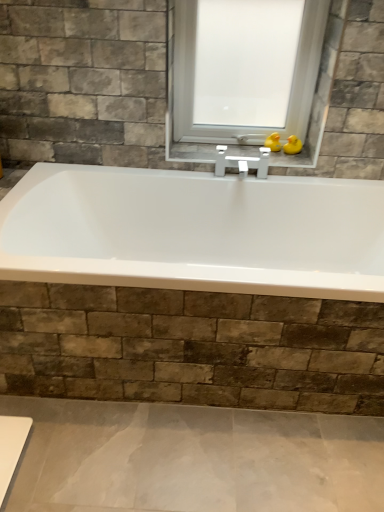
The image size is (384, 512). What do you see at coordinates (247, 75) in the screenshot? I see `transparent glass window at center` at bounding box center [247, 75].

At what (x,y) coordinates should I click in order to perform the action: click on yellow rubber duck at upper right, the 1th duck when ordered from right to left. Please return your answer as a coordinate pair (x, y). This screenshot has width=384, height=512. Looking at the image, I should click on (292, 145).

Image resolution: width=384 pixels, height=512 pixels. What do you see at coordinates (273, 142) in the screenshot? I see `yellow rubber duck at upper center, marked as the 2th duck in a right-to-left arrangement` at bounding box center [273, 142].

Where is `transparent glass window at center`? This screenshot has width=384, height=512. transparent glass window at center is located at coordinates (247, 75).

Based on the photo, is yellow rubber duck at upper right, the 2th duck in the left-to-right sequence, inside the boundaries of yellow rubber duck at upper center, the 1th duck viewed from the left, or outside?

The correct answer is: outside.

Which of these two, yellow rubber duck at upper right, the 2th duck in the left-to-right sequence, or yellow rubber duck at upper center, marked as the 2th duck in a right-to-left arrangement, stands shorter?

yellow rubber duck at upper right, the 2th duck in the left-to-right sequence, is shorter.

Relative to yellow rubber duck at upper center, the 1th duck viewed from the left, is yellow rubber duck at upper right, the 2th duck in the left-to-right sequence, in front or behind?

yellow rubber duck at upper right, the 2th duck in the left-to-right sequence, is positioned closer to the viewer than yellow rubber duck at upper center, the 1th duck viewed from the left.

You are a GUI agent. You are given a task and a screenshot of the screen. Output one action in this format:
    pyautogui.click(x=<x>, y=<y>)
    Task: Click on the duck located underneath the yellow rubber duck at upper right, the 2th duck in the left-to-right sequence (from a real-world perspective)
    
    Given the screenshot: What is the action you would take?
    pyautogui.click(x=273, y=142)

Considering the relative positions of transparent glass window at center and yellow rubber duck at upper right, the 2th duck in the left-to-right sequence, in the image provided, is transparent glass window at center in front of yellow rubber duck at upper right, the 2th duck in the left-to-right sequence,?

Yes, the depth of transparent glass window at center is less than that of yellow rubber duck at upper right, the 2th duck in the left-to-right sequence.

Looking at this image, considering the sizes of transparent glass window at center and yellow rubber duck at upper right, the 1th duck when ordered from right to left, in the image, is transparent glass window at center taller or shorter than yellow rubber duck at upper right, the 1th duck when ordered from right to left,?

In the image, transparent glass window at center appears to be taller than yellow rubber duck at upper right, the 1th duck when ordered from right to left.

Could you measure the distance between transparent glass window at center and yellow rubber duck at upper right, the 1th duck when ordered from right to left?

The distance of transparent glass window at center from yellow rubber duck at upper right, the 1th duck when ordered from right to left, is 38.32 centimeters.

Can you see transparent glass window at center touching yellow rubber duck at upper right, the 2th duck in the left-to-right sequence?

No.

Choose the correct answer: Is yellow rubber duck at upper right, the 1th duck when ordered from right to left, inside transparent glass window at center or outside it?

yellow rubber duck at upper right, the 1th duck when ordered from right to left, is outside transparent glass window at center.

From a real-world perspective, is yellow rubber duck at upper right, the 1th duck when ordered from right to left, positioned above or below transparent glass window at center?

Clearly, from a real-world perspective, yellow rubber duck at upper right, the 1th duck when ordered from right to left, is below transparent glass window at center.

Based on their sizes in the image, would you say yellow rubber duck at upper right, the 1th duck when ordered from right to left, is bigger or smaller than transparent glass window at center?

In the image, yellow rubber duck at upper right, the 1th duck when ordered from right to left, appears to be smaller than transparent glass window at center.

Considering the relative sizes of transparent glass window at center and yellow rubber duck at upper center, marked as the 2th duck in a right-to-left arrangement, in the image provided, is transparent glass window at center shorter than yellow rubber duck at upper center, marked as the 2th duck in a right-to-left arrangement,?

In fact, transparent glass window at center may be taller than yellow rubber duck at upper center, marked as the 2th duck in a right-to-left arrangement.

From a real-world perspective, which object rests below the other?

yellow rubber duck at upper center, the 1th duck viewed from the left.

Is transparent glass window at center oriented away from yellow rubber duck at upper center, marked as the 2th duck in a right-to-left arrangement?

No, transparent glass window at center's orientation is not away from yellow rubber duck at upper center, marked as the 2th duck in a right-to-left arrangement.

Is yellow rubber duck at upper center, the 1th duck viewed from the left, further to the viewer compared to transparent glass window at center?

That is True.

Is yellow rubber duck at upper center, the 1th duck viewed from the left, in contact with transparent glass window at center?

No, yellow rubber duck at upper center, the 1th duck viewed from the left, is not in contact with transparent glass window at center.

Which of these two, yellow rubber duck at upper center, marked as the 2th duck in a right-to-left arrangement, or transparent glass window at center, is thinner?

With smaller width is yellow rubber duck at upper center, marked as the 2th duck in a right-to-left arrangement.

Between yellow rubber duck at upper center, marked as the 2th duck in a right-to-left arrangement, and transparent glass window at center, which one has smaller size?

yellow rubber duck at upper center, marked as the 2th duck in a right-to-left arrangement.

From a real-world perspective, between yellow rubber duck at upper center, the 1th duck viewed from the left, and yellow rubber duck at upper right, the 2th duck in the left-to-right sequence, who is vertically lower?

In real-world perspective, yellow rubber duck at upper center, the 1th duck viewed from the left, is lower.

In the scene shown: Could you measure the distance between yellow rubber duck at upper center, the 1th duck viewed from the left, and yellow rubber duck at upper right, the 2th duck in the left-to-right sequence?

The distance of yellow rubber duck at upper center, the 1th duck viewed from the left, from yellow rubber duck at upper right, the 2th duck in the left-to-right sequence, is 2.38 inches.

How many degrees apart are the facing directions of yellow rubber duck at upper center, marked as the 2th duck in a right-to-left arrangement, and yellow rubber duck at upper right, the 2th duck in the left-to-right sequence?

The angle between the facing direction of yellow rubber duck at upper center, marked as the 2th duck in a right-to-left arrangement, and the facing direction of yellow rubber duck at upper right, the 2th duck in the left-to-right sequence, is 0.00449 degrees.

In the image, is yellow rubber duck at upper center, marked as the 2th duck in a right-to-left arrangement, positioned in front of or behind yellow rubber duck at upper right, the 2th duck in the left-to-right sequence?

yellow rubber duck at upper center, marked as the 2th duck in a right-to-left arrangement, is behind yellow rubber duck at upper right, the 2th duck in the left-to-right sequence.

Where is `duck behind the yellow rubber duck at upper right, the 2th duck in the left-to-right sequence`? duck behind the yellow rubber duck at upper right, the 2th duck in the left-to-right sequence is located at coordinates (273, 142).

Image resolution: width=384 pixels, height=512 pixels. I want to click on window lying above the yellow rubber duck at upper right, the 2th duck in the left-to-right sequence (from the image's perspective), so click(247, 75).

Considering their positions, is yellow rubber duck at upper center, marked as the 2th duck in a right-to-left arrangement, positioned further to transparent glass window at center than yellow rubber duck at upper right, the 2th duck in the left-to-right sequence?

yellow rubber duck at upper right, the 2th duck in the left-to-right sequence, lies further to transparent glass window at center than the other object.

When comparing their distances from yellow rubber duck at upper right, the 2th duck in the left-to-right sequence, does yellow rubber duck at upper center, the 1th duck viewed from the left, or transparent glass window at center seem further?

Based on the image, transparent glass window at center appears to be further to yellow rubber duck at upper right, the 2th duck in the left-to-right sequence.

From the image, which object appears to be farther from yellow rubber duck at upper right, the 1th duck when ordered from right to left, transparent glass window at center or yellow rubber duck at upper center, the 1th duck viewed from the left?

The object further to yellow rubber duck at upper right, the 1th duck when ordered from right to left, is transparent glass window at center.

Looking at the image, which one is located closer to transparent glass window at center, yellow rubber duck at upper right, the 1th duck when ordered from right to left, or yellow rubber duck at upper center, marked as the 2th duck in a right-to-left arrangement?

yellow rubber duck at upper center, marked as the 2th duck in a right-to-left arrangement.

Which object lies further to the anchor point yellow rubber duck at upper center, the 1th duck viewed from the left, transparent glass window at center or yellow rubber duck at upper right, the 2th duck in the left-to-right sequence?

Among the two, transparent glass window at center is located further to yellow rubber duck at upper center, the 1th duck viewed from the left.

Based on their spatial positions, is yellow rubber duck at upper right, the 2th duck in the left-to-right sequence, or transparent glass window at center further from yellow rubber duck at upper center, the 1th duck viewed from the left?

transparent glass window at center lies further to yellow rubber duck at upper center, the 1th duck viewed from the left, than the other object.

Identify the location of duck that lies between transparent glass window at center and yellow rubber duck at upper right, the 1th duck when ordered from right to left, from top to bottom. The width and height of the screenshot is (384, 512). (273, 142).